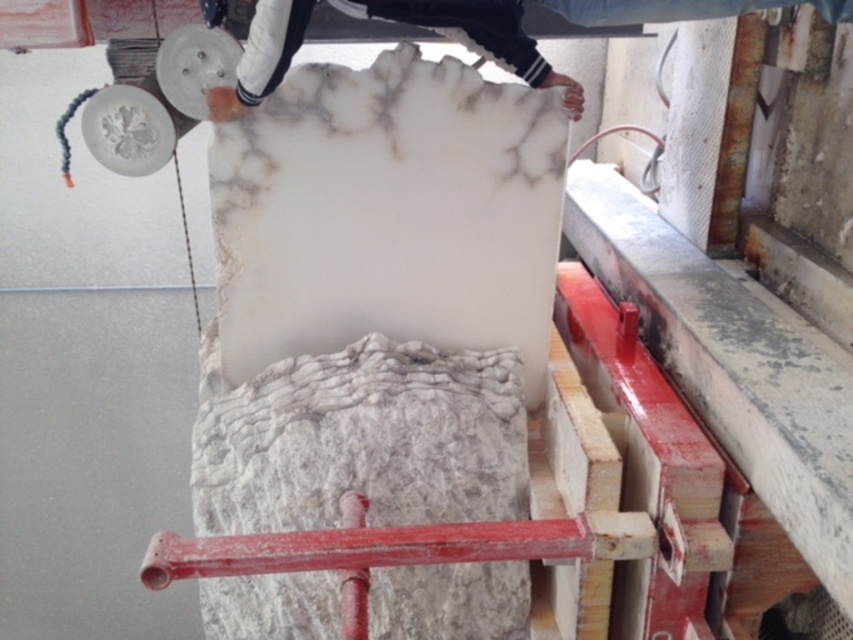
You are an architect designing a new sculpture and need to place a marker at the exact center of the white marble at center. According to the coordinates provided, where should you place the marker?

The marker should be placed at the coordinates point (363, 440) as that is the position of the white marble at center.

You are an artisan working with marble slabs. You have two pieces of marble in front of you, the white marble at center and the white marble slab at upper center. Which one is wider?

The white marble slab at upper center is wider than the white marble at center.